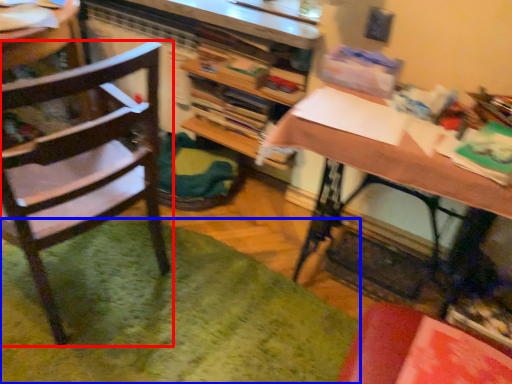
Question: Which object is further to the camera taking this photo, chair (highlighted by a red box) or mat (highlighted by a blue box)?

Choices:
 (A) chair
 (B) mat

Answer: (B)